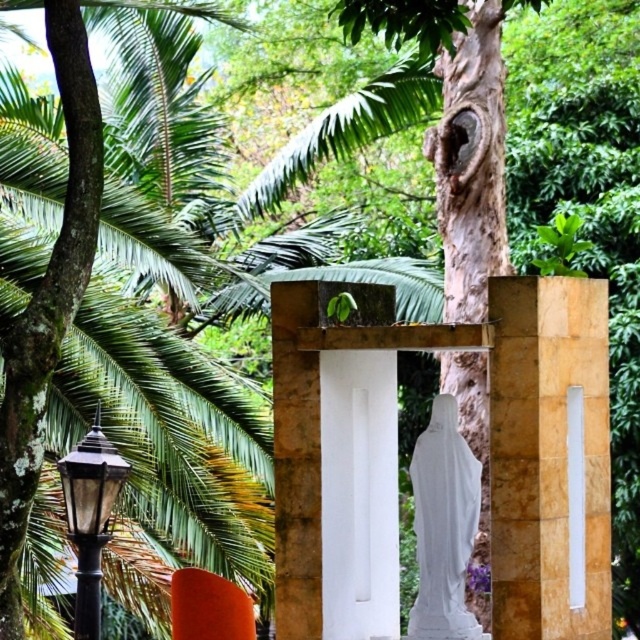
Question: Does white marble statue at center appear under black glass lamp post at left?

Choices:
 (A) yes
 (B) no

Answer: (B)

Question: Which object is closer to the camera taking this photo?

Choices:
 (A) white marble statue at center
 (B) black glass lamp post at left

Answer: (A)

Question: Among these points, which one is nearest to the camera?

Choices:
 (A) (92, 589)
 (B) (419, 557)

Answer: (B)

Question: Does white marble statue at center have a greater width compared to black glass lamp post at left?

Choices:
 (A) yes
 (B) no

Answer: (B)

Question: Which point is closer to the camera taking this photo?

Choices:
 (A) (92, 467)
 (B) (432, 404)

Answer: (A)

Question: Can you confirm if white marble statue at center is positioned above black glass lamp post at left?

Choices:
 (A) no
 (B) yes

Answer: (B)